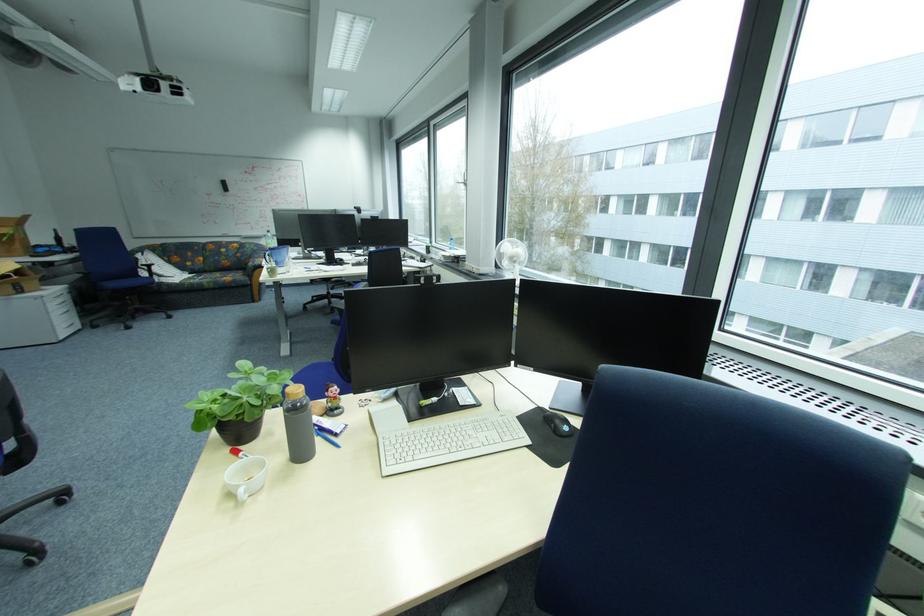
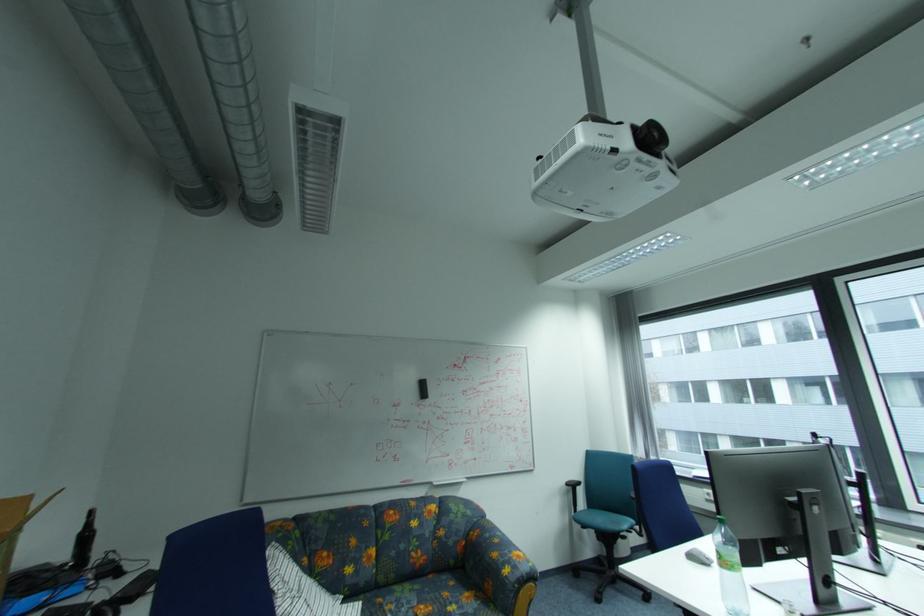
Where in the second image is the point corresponding to (x=259, y=265) from the first image?

(515, 572)